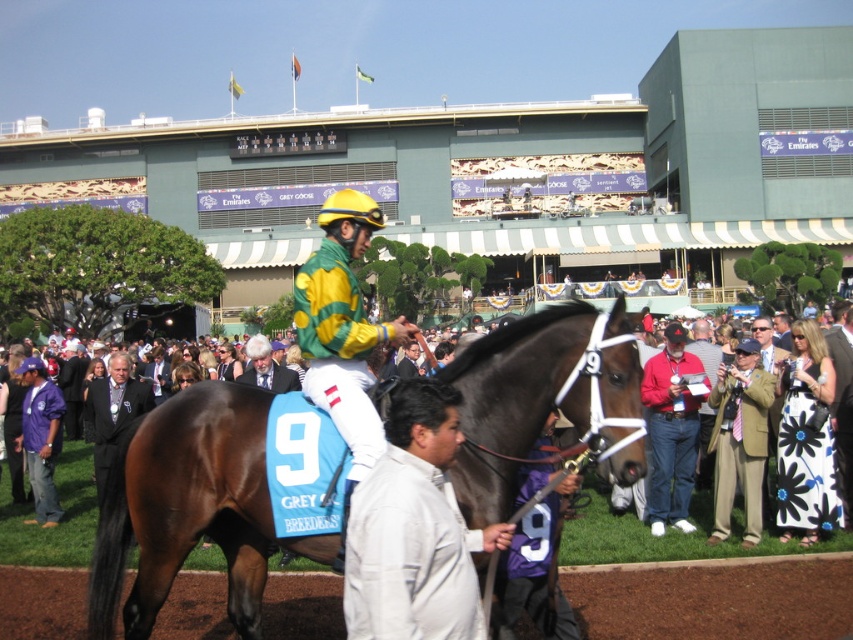
Which is more to the right, brown glossy horse at center or white matte jacket at center?

white matte jacket at center

Does brown glossy horse at center have a lesser height compared to white matte jacket at center?

Incorrect, brown glossy horse at center's height does not fall short of white matte jacket at center's.

Locate an element on the screen. The image size is (853, 640). brown glossy horse at center is located at coordinates (190, 508).

Where is `brown glossy horse at center`? Image resolution: width=853 pixels, height=640 pixels. brown glossy horse at center is located at coordinates click(x=190, y=508).

Which of these two, purple fabric jacket at lower left or dark suit at center, stands taller?

purple fabric jacket at lower left is taller.

How far apart are purple fabric jacket at lower left and dark suit at center?

The distance of purple fabric jacket at lower left from dark suit at center is 7.81 feet.

Find the location of a particular element. The height and width of the screenshot is (640, 853). purple fabric jacket at lower left is located at coordinates (39, 436).

Does yellow-green jersey at center appear on the left side of gray wool suit at center?

Incorrect, yellow-green jersey at center is not on the left side of gray wool suit at center.

Is yellow-green jersey at center bigger than gray wool suit at center?

No.

Find the location of a particular element. yellow-green jersey at center is located at coordinates coord(343,326).